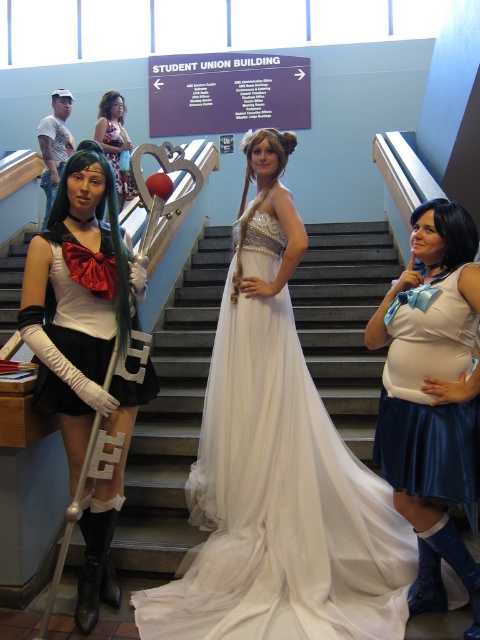
Question: Is satin white dress at left thinner than matte black dress at center?

Choices:
 (A) no
 (B) yes

Answer: (A)

Question: Based on their relative distances, which object is farther from the matte white dress at center?

Choices:
 (A) satin white dress at left
 (B) matte black cosplay dress at left
 (C) white satin gown at center

Answer: (A)

Question: Which point appears farthest from the camera in this image?

Choices:
 (A) (43, 289)
 (B) (104, 134)

Answer: (B)

Question: Does matte white dress at center lie behind matte black dress at center?

Choices:
 (A) no
 (B) yes

Answer: (A)

Question: Is matte black cosplay dress at left wider than satin white dress at left?

Choices:
 (A) yes
 (B) no

Answer: (B)

Question: Which point is farther to the camera?

Choices:
 (A) (116, 132)
 (B) (86, 412)
 (C) (226, 442)

Answer: (A)